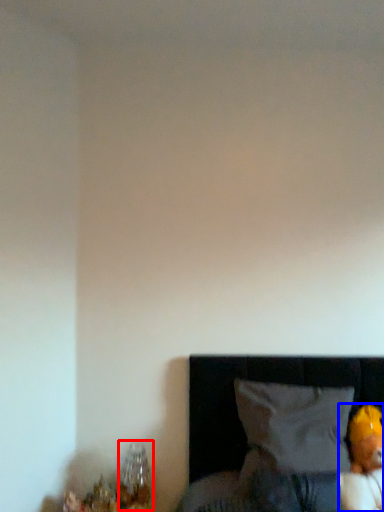
Question: Which of the following is the farthest to the observer, table lamp (highlighted by a red box) or toy (highlighted by a blue box)?

Choices:
 (A) table lamp
 (B) toy

Answer: (A)